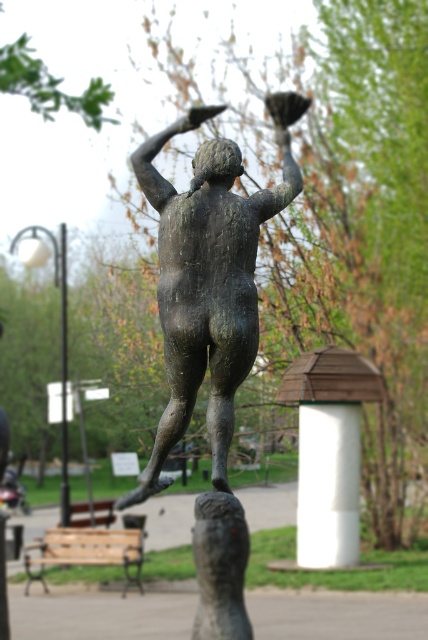
Question: From the image, what is the correct spatial relationship of wooden park bench at lower left in relation to bronze pole at center?

Choices:
 (A) right
 (B) left

Answer: (A)

Question: Does bronze statue at center appear under wooden park bench at lower left?

Choices:
 (A) yes
 (B) no

Answer: (B)

Question: Can you confirm if white painted wood at center is positioned to the left of wooden park bench at lower left?

Choices:
 (A) no
 (B) yes

Answer: (A)

Question: Among these points, which one is nearest to the camera?

Choices:
 (A) (302, 509)
 (B) (181, 225)
 (C) (317, 376)
 (D) (65, 308)

Answer: (B)

Question: Among these objects, which one is farthest from the camera?

Choices:
 (A) bronze statue at center
 (B) white painted wood at center
 (C) bronze pole at center

Answer: (C)

Question: Which of the following is the closest to the observer?

Choices:
 (A) coord(299,176)
 (B) coord(347,490)
 (C) coord(80,536)

Answer: (A)